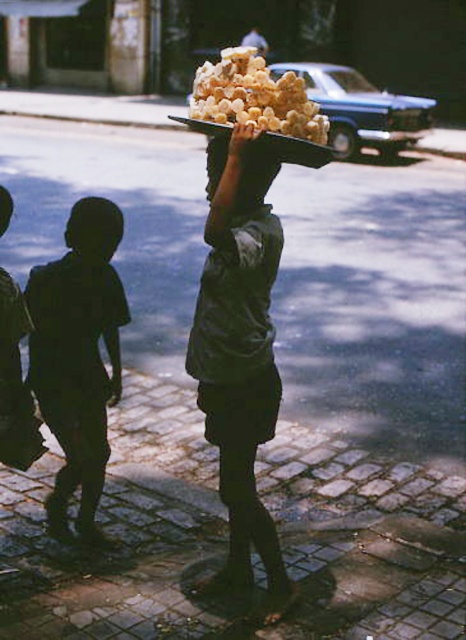
Question: Does dark green fabric shirt at center have a smaller size compared to black matte head at center?

Choices:
 (A) no
 (B) yes

Answer: (A)

Question: Which object is closer to the camera taking this photo?

Choices:
 (A) golden crispy pastry at center
 (B) silhouette skin child at left
 (C) black matte head at center
 (D) smooth black head at upper left

Answer: (A)

Question: Can you confirm if dark green fabric shirt at center is positioned above golden crispy pastry at center?

Choices:
 (A) no
 (B) yes

Answer: (A)

Question: From the image, what is the correct spatial relationship of golden crispy pastry at center in relation to smooth black head at upper left?

Choices:
 (A) below
 (B) above

Answer: (B)

Question: Which object appears closest to the camera in this image?

Choices:
 (A) golden crispy pastry at center
 (B) silhouette skin child at left
 (C) black matte head at center

Answer: (A)

Question: Considering the real-world distances, which object is closest to the silhouette skin child at left?

Choices:
 (A) black matte head at center
 (B) smooth black head at upper left
 (C) matte brown head at center
 (D) dark green fabric shirt at center

Answer: (A)